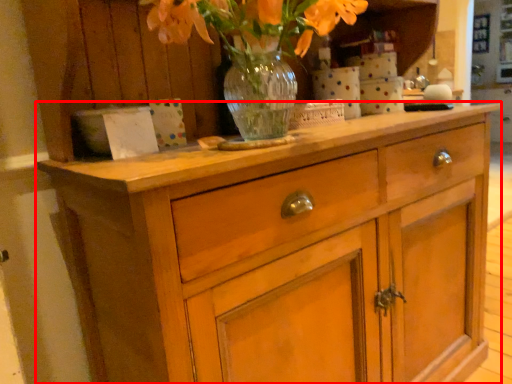
Question: From the image's perspective, where is chest of drawers (annotated by the red box) located in relation to floral arrangement in the image?

Choices:
 (A) above
 (B) below

Answer: (B)